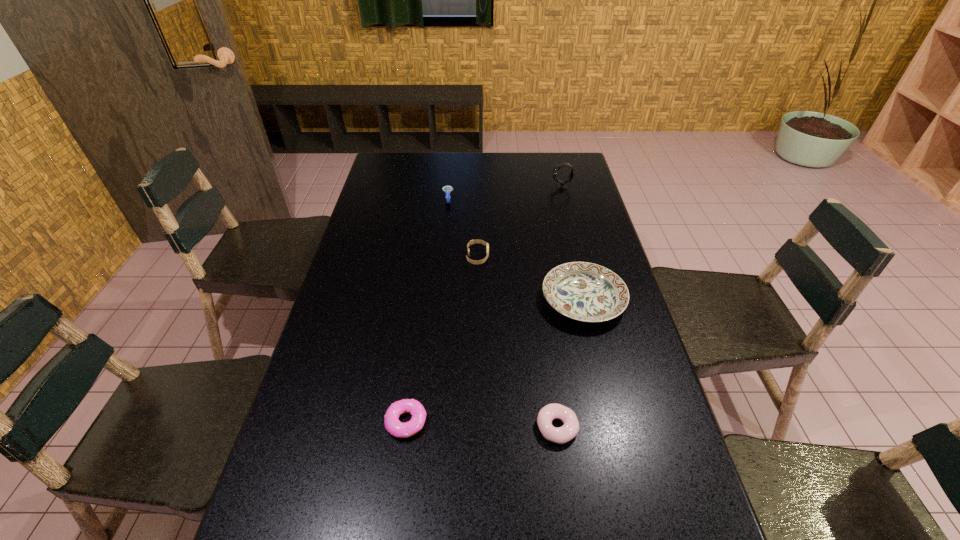
In the image, there is a desktop. Where is `vacant space at the left edge`? The image size is (960, 540). vacant space at the left edge is located at coordinates (393, 233).

This screenshot has width=960, height=540. Identify the location of free space at the right edge of the desktop. (601, 228).

Locate an element on the screen. This screenshot has width=960, height=540. free space at the far left corner of the desktop is located at coordinates (403, 177).

Where is `free location at the far right corner of the desktop`? The image size is (960, 540). free location at the far right corner of the desktop is located at coordinates (558, 154).

Locate an element on the screen. Image resolution: width=960 pixels, height=540 pixels. free space between the fourth farthest object and the left doughnut is located at coordinates (494, 361).

The width and height of the screenshot is (960, 540). I want to click on free space between the second farthest watch and the nearest watch, so click(463, 228).

Where is `unoccupied area between the left doughnut and the fifth nearest object`? Image resolution: width=960 pixels, height=540 pixels. unoccupied area between the left doughnut and the fifth nearest object is located at coordinates (427, 311).

Locate an element on the screen. Image resolution: width=960 pixels, height=540 pixels. free space between the tallest watch and the fourth farthest object is located at coordinates (572, 244).

Where is `free space that is in between the second farthest watch and the left doughnut`? The width and height of the screenshot is (960, 540). free space that is in between the second farthest watch and the left doughnut is located at coordinates tap(427, 311).

Locate an element on the screen. This screenshot has width=960, height=540. empty space between the tallest watch and the plate is located at coordinates (572, 244).